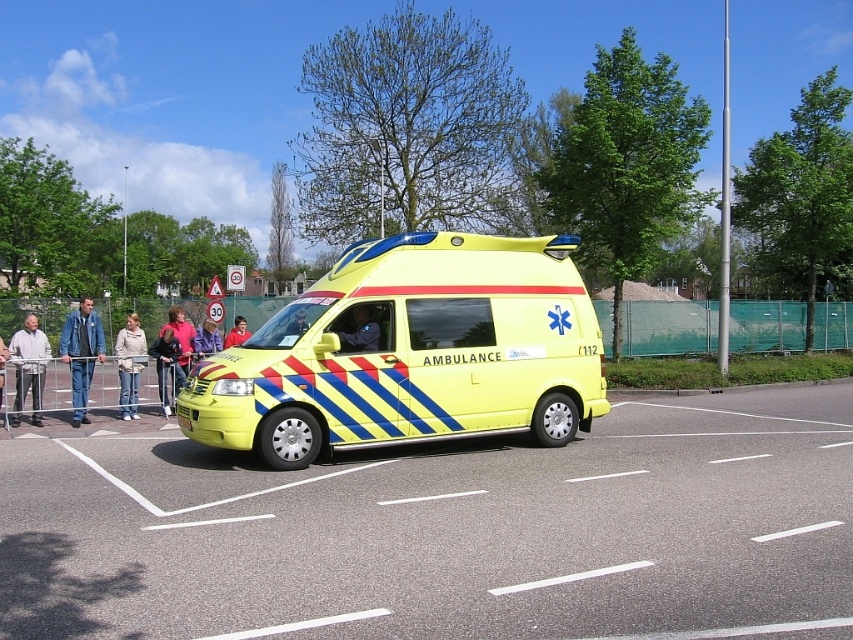
You are a delivery person who needs to place a package between the blue denim jacket at left and the light beige sweater at center. The package requires 0.8 meters of space. Is there enough space between them to place the package?

The blue denim jacket at left and light beige sweater at center are 1.00 meters apart from each other. Since the package requires 0.8 meters, there is enough space to place the package between them.

You are a fashion designer observing the blue denim jacket at left and the light beige sweater at center in the scene. Which clothing item is shorter in height?

The blue denim jacket at left is not as tall as the light beige sweater at center, so the blue denim jacket at left is shorter in height.

You are a photographer trying to capture both the yellow matte ambulance at center and the light beige sweater at center in the same frame. Based on their sizes in the image, which object would you need to move closer to the camera to ensure both are visible clearly?

The light beige sweater at center is smaller than the yellow matte ambulance at center, so you would need to move the light beige sweater at center closer to the camera to ensure it appears larger and clearer in the photo.